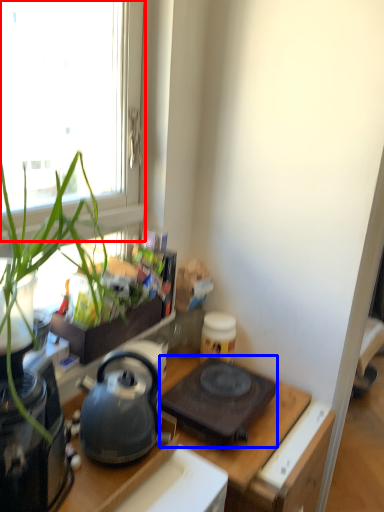
Question: Which object appears closest to the camera in this image, window (highlighted by a red box) or gas stove (highlighted by a blue box)?

Choices:
 (A) window
 (B) gas stove

Answer: (A)